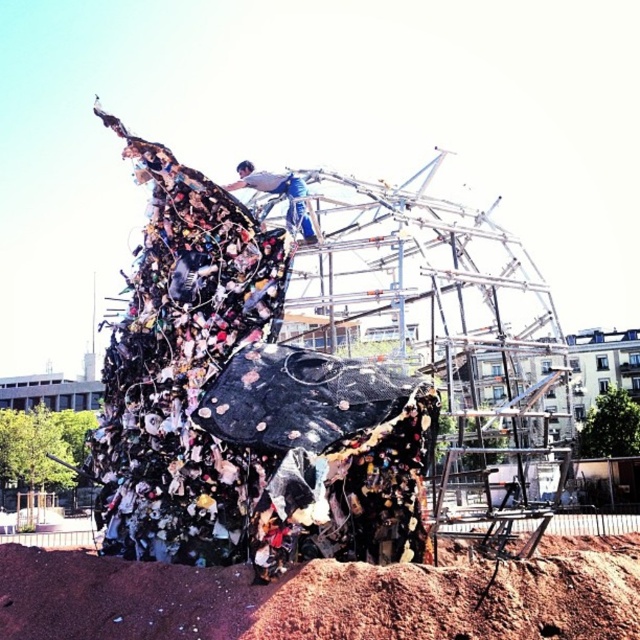
Question: Among these objects, which one is nearest to the camera?

Choices:
 (A) brown dirt mound at lower center
 (B) white fabric at upper center

Answer: (A)

Question: Is brown dirt mound at lower center positioned in front of white fabric at upper center?

Choices:
 (A) yes
 (B) no

Answer: (A)

Question: Is brown dirt mound at lower center to the right of white fabric at upper center from the viewer's perspective?

Choices:
 (A) yes
 (B) no

Answer: (A)

Question: Is brown dirt mound at lower center behind white fabric at upper center?

Choices:
 (A) no
 (B) yes

Answer: (A)

Question: Which point is closer to the camera?

Choices:
 (A) brown dirt mound at lower center
 (B) white fabric at upper center

Answer: (A)